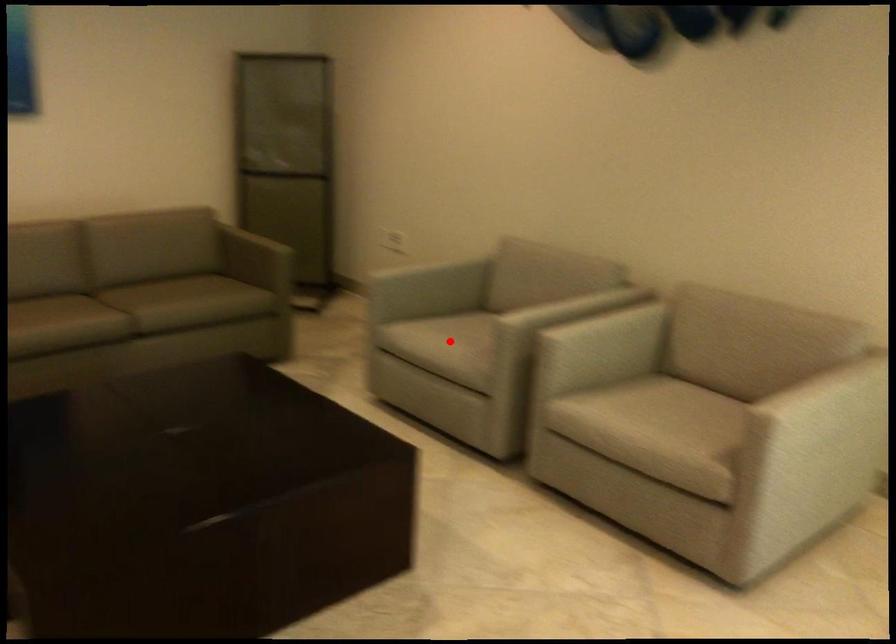
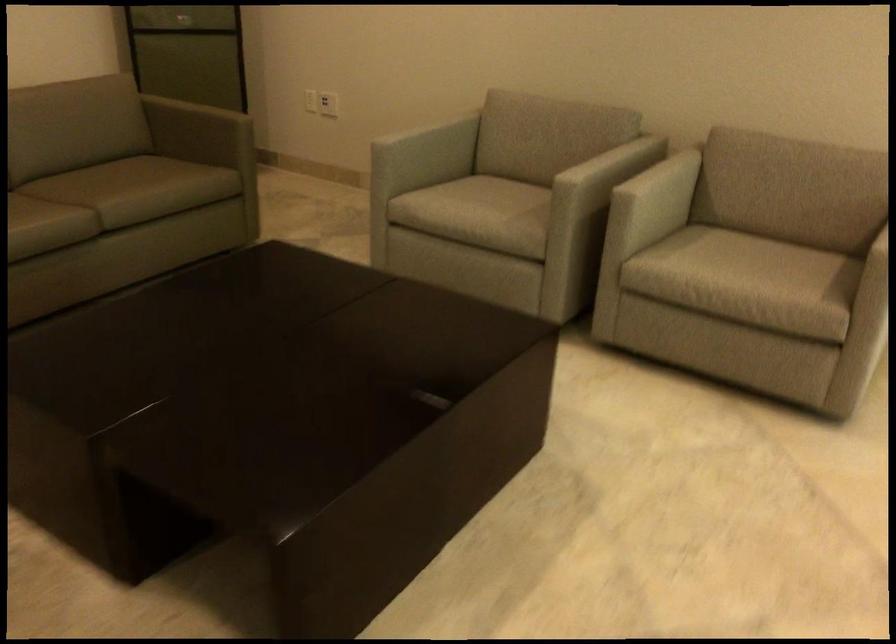
Where in the second image is the point corresponding to the highlighted location from the first image?

(480, 207)